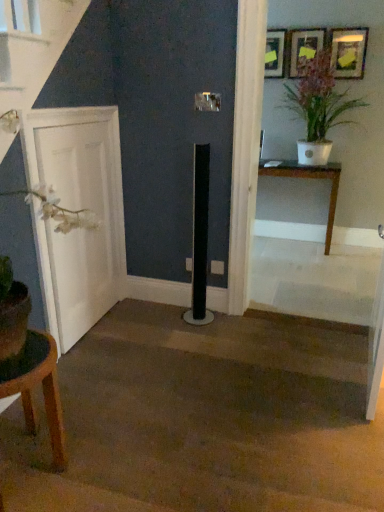
Question: Is wooden picture frame at upper center, acting as the 2th picture frame starting from the left, far away from brown wooden table at lower left, the second table from the right?

Choices:
 (A) no
 (B) yes

Answer: (B)

Question: Is wooden picture frame at upper center, acting as the 2th picture frame starting from the left, positioned behind brown wooden table at lower left, the second table positioned from the back?

Choices:
 (A) no
 (B) yes

Answer: (B)

Question: From a real-world perspective, is wooden picture frame at upper center, which ranks as the 2th picture frame in right-to-left order, positioned over brown wooden table at lower left, the 1th table viewed from the front, based on gravity?

Choices:
 (A) no
 (B) yes

Answer: (B)

Question: Is wooden picture frame at upper center, acting as the 2th picture frame starting from the left, facing away from brown wooden table at lower left, the second table positioned from the back?

Choices:
 (A) no
 (B) yes

Answer: (A)

Question: Does wooden picture frame at upper center, which ranks as the 2th picture frame in right-to-left order, have a lesser width compared to brown wooden table at lower left, the second table positioned from the back?

Choices:
 (A) yes
 (B) no

Answer: (A)

Question: Based on their sizes in the image, would you say wooden table at right, the second table positioned from the left, is bigger or smaller than brown wooden table at lower left, the second table positioned from the top?

Choices:
 (A) small
 (B) big

Answer: (B)

Question: From their relative heights in the image, would you say wooden table at right, placed as the first table when sorted from top to bottom, is taller or shorter than brown wooden table at lower left, the second table from the right?

Choices:
 (A) short
 (B) tall

Answer: (B)

Question: Is wooden table at right, placed as the 1th table when sorted from back to front, situated inside brown wooden table at lower left, the 1th table positioned from the bottom, or outside?

Choices:
 (A) outside
 (B) inside

Answer: (A)

Question: From a real-world perspective, is wooden table at right, placed as the first table when sorted from top to bottom, above or below brown wooden table at lower left, the second table from the right?

Choices:
 (A) above
 (B) below

Answer: (A)

Question: From the image's perspective, is white glossy pot at upper right positioned above or below white matte door at left?

Choices:
 (A) below
 (B) above

Answer: (B)

Question: Is white glossy pot at upper right inside or outside of white matte door at left?

Choices:
 (A) outside
 (B) inside

Answer: (A)

Question: Considering the positions of white glossy pot at upper right and white matte door at left in the image, is white glossy pot at upper right wider or thinner than white matte door at left?

Choices:
 (A) wide
 (B) thin

Answer: (A)

Question: In the image, is white glossy pot at upper right positioned in front of or behind white matte door at left?

Choices:
 (A) front
 (B) behind

Answer: (B)

Question: Considering the positions of point (281, 59) and point (54, 346), is point (281, 59) closer or farther from the camera than point (54, 346)?

Choices:
 (A) farther
 (B) closer

Answer: (A)

Question: From a real-world perspective, relative to brown wooden table at lower left, the second table positioned from the top, is matte black picture frame at upper center, the first picture frame when ordered from left to right, vertically above or below?

Choices:
 (A) above
 (B) below

Answer: (A)